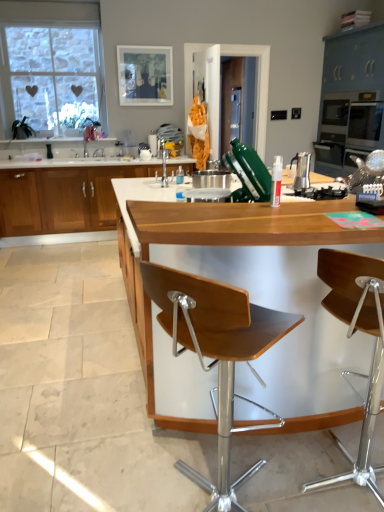
Question: From a real-world perspective, is wooden cabinet at left, arranged as the 1th cabinetry when viewed from the left, under wooden seat at center, acting as the 2th chair starting from the right?

Choices:
 (A) yes
 (B) no

Answer: (A)

Question: From the image's perspective, is wooden cabinet at left, arranged as the 1th cabinetry when viewed from the left, above wooden seat at center, acting as the 2th chair starting from the right?

Choices:
 (A) yes
 (B) no

Answer: (A)

Question: Is the position of wooden cabinet at left, arranged as the 1th cabinetry when viewed from the left, more distant than that of wooden seat at center, arranged as the first chair when viewed from the left?

Choices:
 (A) no
 (B) yes

Answer: (B)

Question: From the image's perspective, is wooden cabinet at left, arranged as the 1th cabinetry when viewed from the left, located beneath wooden seat at center, arranged as the first chair when viewed from the left?

Choices:
 (A) yes
 (B) no

Answer: (B)

Question: From a real-world perspective, is wooden cabinet at left, placed as the 2th cabinetry when sorted from right to left, on top of wooden seat at center, acting as the 2th chair starting from the right?

Choices:
 (A) yes
 (B) no

Answer: (B)

Question: Is wooden cabinet at left, arranged as the 1th cabinetry when viewed from the left, facing away from wooden seat at center, arranged as the first chair when viewed from the left?

Choices:
 (A) no
 (B) yes

Answer: (A)

Question: From the image's perspective, is white matte picture frame at upper center over wooden seat at center, arranged as the first chair when viewed from the left?

Choices:
 (A) no
 (B) yes

Answer: (B)

Question: From a real-world perspective, is white matte picture frame at upper center positioned over wooden seat at center, arranged as the first chair when viewed from the left, based on gravity?

Choices:
 (A) yes
 (B) no

Answer: (A)

Question: Is wooden seat at center, acting as the 2th chair starting from the right, a part of white matte picture frame at upper center?

Choices:
 (A) no
 (B) yes

Answer: (A)

Question: Is white matte picture frame at upper center oriented towards wooden seat at center, arranged as the first chair when viewed from the left?

Choices:
 (A) yes
 (B) no

Answer: (A)

Question: Is the position of white matte picture frame at upper center more distant than that of wooden seat at center, arranged as the first chair when viewed from the left?

Choices:
 (A) yes
 (B) no

Answer: (A)

Question: Considering the relative sizes of white matte picture frame at upper center and wooden seat at center, acting as the 2th chair starting from the right, in the image provided, is white matte picture frame at upper center wider than wooden seat at center, acting as the 2th chair starting from the right,?

Choices:
 (A) yes
 (B) no

Answer: (B)

Question: Can you confirm if wooden at center, the second countertop viewed from the back, is positioned to the left of wooden seat at center, arranged as the first chair when viewed from the left?

Choices:
 (A) yes
 (B) no

Answer: (B)